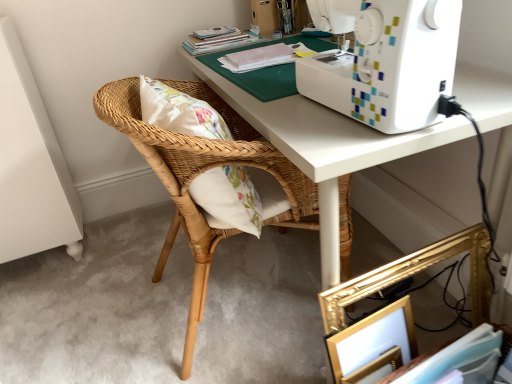
Find the location of a particular element. This screenshot has width=512, height=384. vacant space in front of matte white book at upper center, the 2th book from the top is located at coordinates (258, 72).